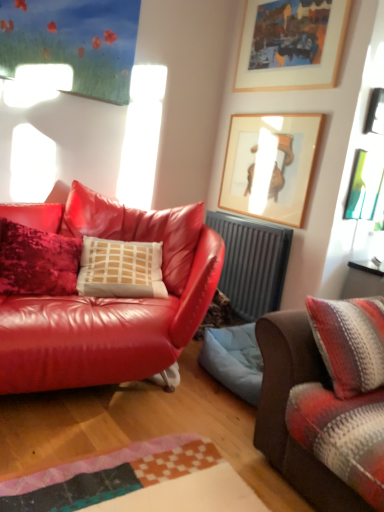
Question: From the image's perspective, is metallic silver frame at upper right, which is counted as the fourth picture frame, starting from the top, located above gray metallic radiator at center?

Choices:
 (A) yes
 (B) no

Answer: (A)

Question: Is metallic silver frame at upper right, the 1th picture frame positioned from the bottom, beside gray metallic radiator at center?

Choices:
 (A) yes
 (B) no

Answer: (B)

Question: Can you confirm if metallic silver frame at upper right, the 1th picture frame positioned from the bottom, is shorter than gray metallic radiator at center?

Choices:
 (A) yes
 (B) no

Answer: (A)

Question: Can you confirm if metallic silver frame at upper right, which is counted as the fourth picture frame, starting from the top, is taller than gray metallic radiator at center?

Choices:
 (A) yes
 (B) no

Answer: (B)

Question: Is metallic silver frame at upper right, which is counted as the fourth picture frame, starting from the top, positioned in front of gray metallic radiator at center?

Choices:
 (A) yes
 (B) no

Answer: (A)

Question: Does metallic silver frame at upper right, which is counted as the fourth picture frame, starting from the top, have a smaller size compared to gray metallic radiator at center?

Choices:
 (A) yes
 (B) no

Answer: (A)

Question: Is metallic silver picture frame at upper right, the 3th picture frame when ordered from bottom to top, at the left side of gray metallic radiator at center?

Choices:
 (A) no
 (B) yes

Answer: (A)

Question: Is metallic silver picture frame at upper right, acting as the second picture frame starting from the top, positioned with its back to gray metallic radiator at center?

Choices:
 (A) no
 (B) yes

Answer: (A)

Question: Is metallic silver picture frame at upper right, the 3th picture frame when ordered from bottom to top, facing towards gray metallic radiator at center?

Choices:
 (A) yes
 (B) no

Answer: (B)

Question: Is metallic silver picture frame at upper right, the 3th picture frame when ordered from bottom to top, positioned far away from gray metallic radiator at center?

Choices:
 (A) no
 (B) yes

Answer: (B)

Question: Can you confirm if metallic silver picture frame at upper right, acting as the second picture frame starting from the top, is smaller than gray metallic radiator at center?

Choices:
 (A) no
 (B) yes

Answer: (B)

Question: Is gray metallic radiator at center located within metallic silver picture frame at upper right, acting as the second picture frame starting from the top?

Choices:
 (A) yes
 (B) no

Answer: (B)

Question: Is wooden picture frame at upper center, arranged as the 4th picture frame when ordered from the bottom, shorter than striped woolen blanket at right, the first studio couch positioned from the right?

Choices:
 (A) no
 (B) yes

Answer: (A)